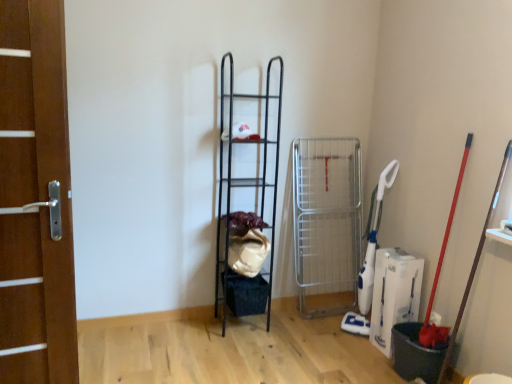
Where is `wooden door at left`? The width and height of the screenshot is (512, 384). wooden door at left is located at coordinates (35, 197).

What do you see at coordinates (35, 197) in the screenshot? This screenshot has height=384, width=512. I see `wooden door at left` at bounding box center [35, 197].

What is the approximate height of wooden door at left?

wooden door at left is 1.68 meters in height.

What do you see at coordinates (247, 193) in the screenshot? This screenshot has width=512, height=384. I see `black metal shelf at center` at bounding box center [247, 193].

Find the location of a particular element. This screenshot has width=512, height=384. black metal shelf at center is located at coordinates (247, 193).

Identify the location of wooden door at left. The width and height of the screenshot is (512, 384). (35, 197).

From the picture: Considering the positions of objects wooden door at left and black metal shelf at center in the image provided, who is more to the left, wooden door at left or black metal shelf at center?

wooden door at left is more to the left.

Is the depth of wooden door at left less than that of black metal shelf at center?

Yes, it is in front of black metal shelf at center.

Considering the positions of points (20, 241) and (250, 214), is point (20, 241) closer to camera compared to point (250, 214)?

Yes, point (20, 241) is closer to viewer.

From the image's perspective, is wooden door at left beneath black metal shelf at center?

Correct, wooden door at left appears lower than black metal shelf at center in the image.

From a real-world perspective, relative to black metal shelf at center, is wooden door at left vertically above or below?

From a real-world perspective, wooden door at left is physically above black metal shelf at center.

Does wooden door at left have a lesser width compared to black metal shelf at center?

Yes.

Is wooden door at left taller or shorter than black metal shelf at center?

Clearly, wooden door at left is shorter compared to black metal shelf at center.

Who is bigger, wooden door at left or black metal shelf at center?

With larger size is black metal shelf at center.

Could black metal shelf at center be considered to be inside wooden door at left?

No, black metal shelf at center is not inside wooden door at left.

Is wooden door at left beside black metal shelf at center?

They are not placed beside each other.

Does wooden door at left turn towards black metal shelf at center?

No, wooden door at left does not turn towards black metal shelf at center.

How many degrees apart are the facing directions of wooden door at left and black metal shelf at center?

The facing directions of wooden door at left and black metal shelf at center are 5.92 degrees apart.

Locate an element on the screen. This screenshot has height=384, width=512. ladder above the wooden door at left (from the image's perspective) is located at coordinates (247, 193).

Considering the positions of objects black metal shelf at center and wooden door at left in the image provided, who is more to the left, black metal shelf at center or wooden door at left?

From the viewer's perspective, wooden door at left appears more on the left side.

Which is behind, black metal shelf at center or wooden door at left?

black metal shelf at center.

Considering the points (239, 188) and (57, 328), which point is behind, point (239, 188) or point (57, 328)?

Point (239, 188)

From the image's perspective, would you say black metal shelf at center is positioned over wooden door at left?

Correct, black metal shelf at center appears higher than wooden door at left in the image.

From a real-world perspective, is black metal shelf at center physically below wooden door at left?

Yes, from a real-world perspective, black metal shelf at center is beneath wooden door at left.

Between black metal shelf at center and wooden door at left, which one has larger width?

black metal shelf at center.

Is black metal shelf at center shorter than wooden door at left?

Incorrect, the height of black metal shelf at center does not fall short of that of wooden door at left.

Who is bigger, black metal shelf at center or wooden door at left?

With larger size is black metal shelf at center.

Could wooden door at left be considered to be inside black metal shelf at center?

No, wooden door at left is not a part of black metal shelf at center.

Is black metal shelf at center positioned far away from wooden door at left?

black metal shelf at center is positioned a significant distance from wooden door at left.

Could you tell me if black metal shelf at center is turned towards wooden door at left?

No, black metal shelf at center is not turned towards wooden door at left.

In order to click on door in front of the black metal shelf at center in this screenshot , I will do `click(35, 197)`.

This screenshot has width=512, height=384. Find the location of `ladder beneath the wooden door at left (from a real-world perspective)`. ladder beneath the wooden door at left (from a real-world perspective) is located at coordinates (247, 193).

Where is `ladder that is above the wooden door at left (from the image's perspective)`? ladder that is above the wooden door at left (from the image's perspective) is located at coordinates (247, 193).